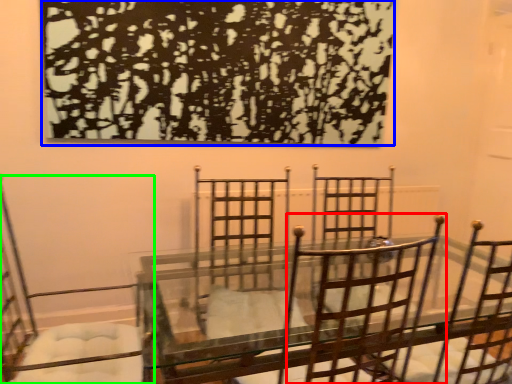
Question: Based on their relative distances, which object is nearer to chair (highlighted by a red box)? Choose from tree (highlighted by a blue box) and chair (highlighted by a green box).

Choices:
 (A) tree
 (B) chair

Answer: (A)